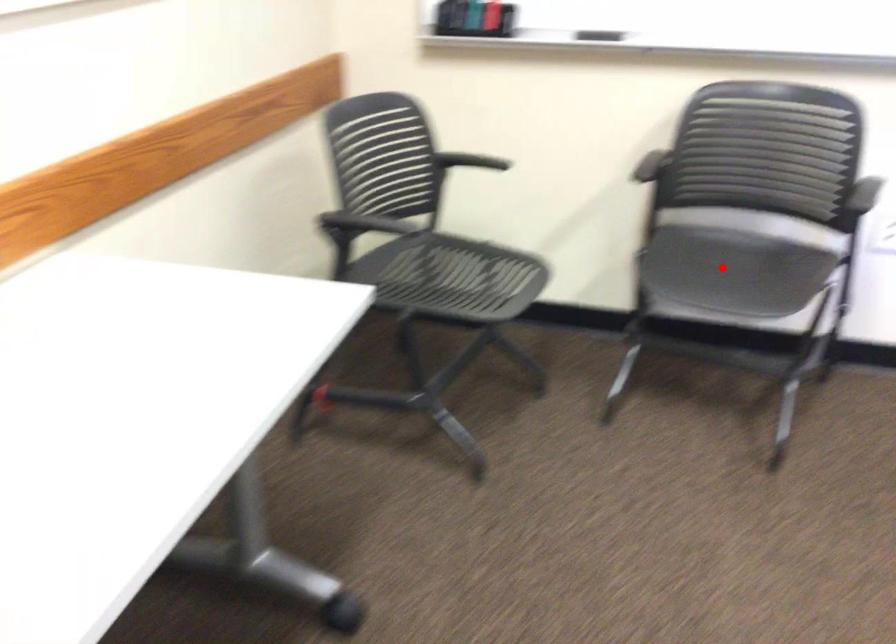
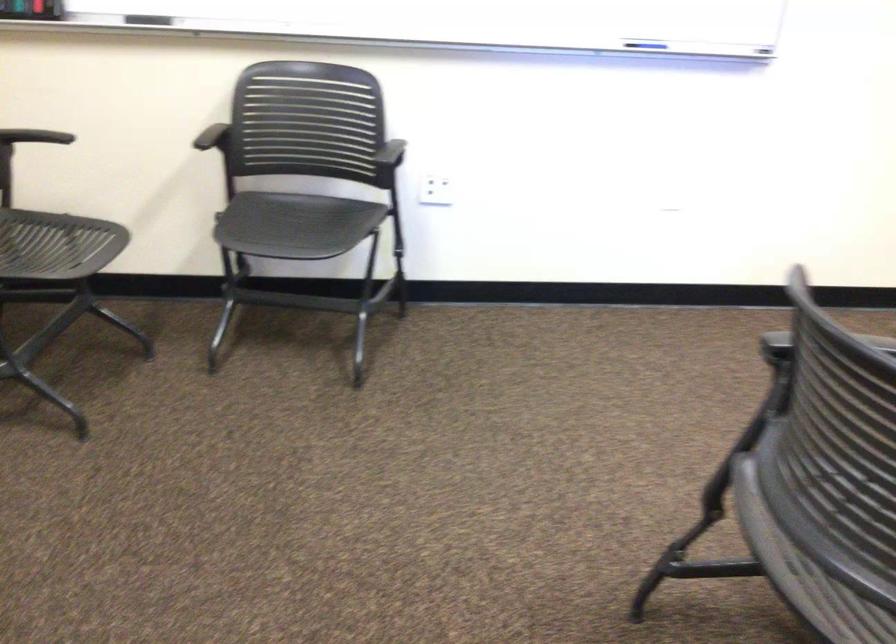
Locate, in the second image, the point that corresponds to the highlighted location in the first image.

(295, 225)